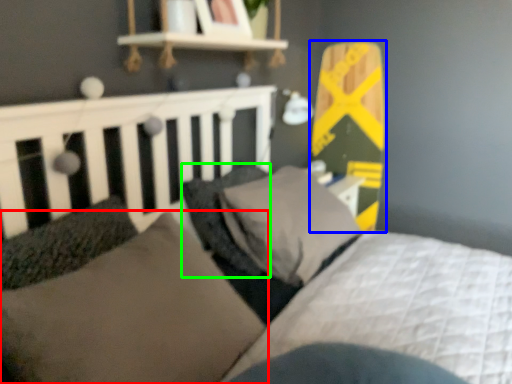
Question: Which is farther away from pillow (highlighted by a red box)? skateboard (highlighted by a blue box) or pillow (highlighted by a green box)?

Choices:
 (A) skateboard
 (B) pillow

Answer: (A)